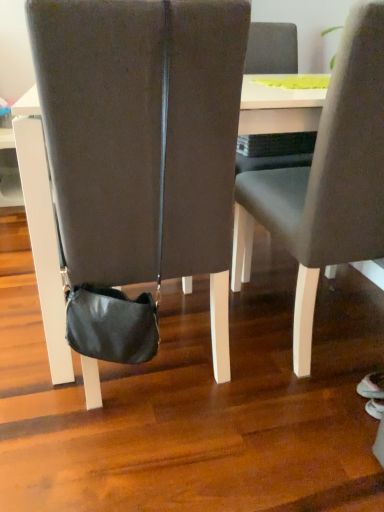
Question: Can you confirm if matte gray chair at center, the first chair from the right, is bigger than black leather bag at center, arranged as the first chair when viewed from the left?

Choices:
 (A) yes
 (B) no

Answer: (B)

Question: Considering the relative sizes of matte gray chair at center, the second chair positioned from the left, and black leather bag at center, arranged as the first chair when viewed from the left, in the image provided, is matte gray chair at center, the second chair positioned from the left, taller than black leather bag at center, arranged as the first chair when viewed from the left,?

Choices:
 (A) no
 (B) yes

Answer: (B)

Question: Is matte gray chair at center, the first chair from the right, next to black leather bag at center, arranged as the first chair when viewed from the left?

Choices:
 (A) no
 (B) yes

Answer: (A)

Question: Is matte gray chair at center, the first chair from the right, looking in the opposite direction of black leather bag at center, arranged as the first chair when viewed from the left?

Choices:
 (A) yes
 (B) no

Answer: (B)

Question: Is matte gray chair at center, the second chair positioned from the left, not close to black leather bag at center, arranged as the first chair when viewed from the left?

Choices:
 (A) no
 (B) yes

Answer: (A)

Question: Is black leather bag at center, arranged as the first chair when viewed from the left, in front of or behind matte gray chair at center, the first chair from the right, in the image?

Choices:
 (A) behind
 (B) front

Answer: (B)

Question: Based on their sizes in the image, would you say black leather bag at center, arranged as the first chair when viewed from the left, is bigger or smaller than matte gray chair at center, the first chair from the right?

Choices:
 (A) big
 (B) small

Answer: (A)

Question: Looking at their shapes, would you say black leather bag at center, arranged as the first chair when viewed from the left, is wider or thinner than matte gray chair at center, the second chair positioned from the left?

Choices:
 (A) thin
 (B) wide

Answer: (B)

Question: Is black leather bag at center, the second chair in the right-to-left sequence, taller or shorter than matte gray chair at center, the second chair positioned from the left?

Choices:
 (A) short
 (B) tall

Answer: (A)

Question: Which is correct: white glossy table at center is inside matte gray chair at center, the second chair positioned from the left, or outside of it?

Choices:
 (A) outside
 (B) inside

Answer: (A)

Question: Looking at their shapes, would you say white glossy table at center is wider or thinner than matte gray chair at center, the first chair from the right?

Choices:
 (A) thin
 (B) wide

Answer: (B)

Question: From a real-world perspective, is white glossy table at center above or below matte gray chair at center, the first chair from the right?

Choices:
 (A) above
 (B) below

Answer: (B)

Question: Considering the positions of white glossy table at center and matte gray chair at center, the second chair positioned from the left, in the image, is white glossy table at center bigger or smaller than matte gray chair at center, the second chair positioned from the left,?

Choices:
 (A) small
 (B) big

Answer: (B)

Question: Is matte gray chair at center, the second chair positioned from the left, in front of or behind white glossy table at center in the image?

Choices:
 (A) front
 (B) behind

Answer: (A)

Question: Is point (362, 19) positioned closer to the camera than point (1, 139)?

Choices:
 (A) farther
 (B) closer

Answer: (B)